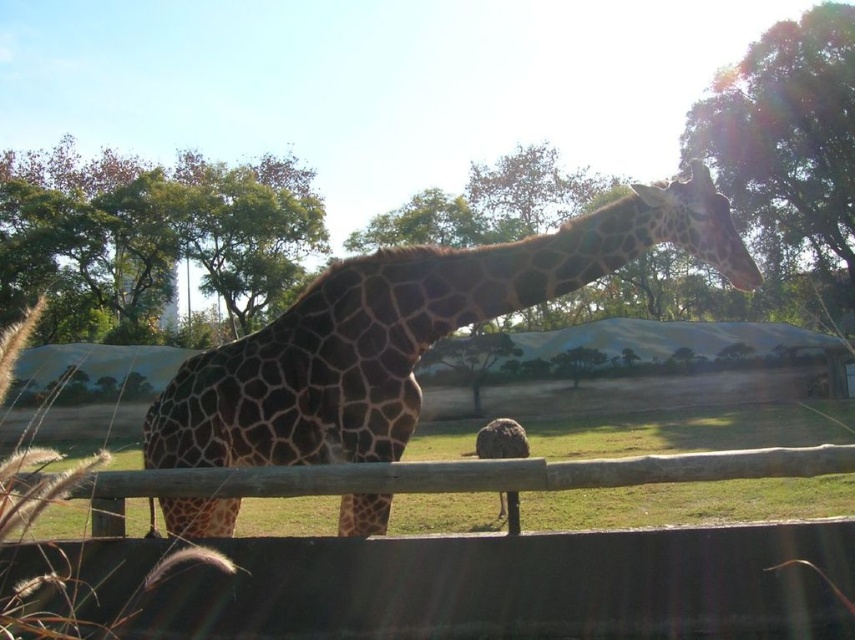
Question: Observing the image, what is the correct spatial positioning of brown spotted giraffe at center in reference to wooden fence at center?

Choices:
 (A) left
 (B) right

Answer: (A)

Question: Is brown spotted giraffe at center behind wooden fence at center?

Choices:
 (A) no
 (B) yes

Answer: (B)

Question: Considering the relative positions of brown spotted giraffe at center and wooden fence at center in the image provided, where is brown spotted giraffe at center located with respect to wooden fence at center?

Choices:
 (A) left
 (B) right

Answer: (A)